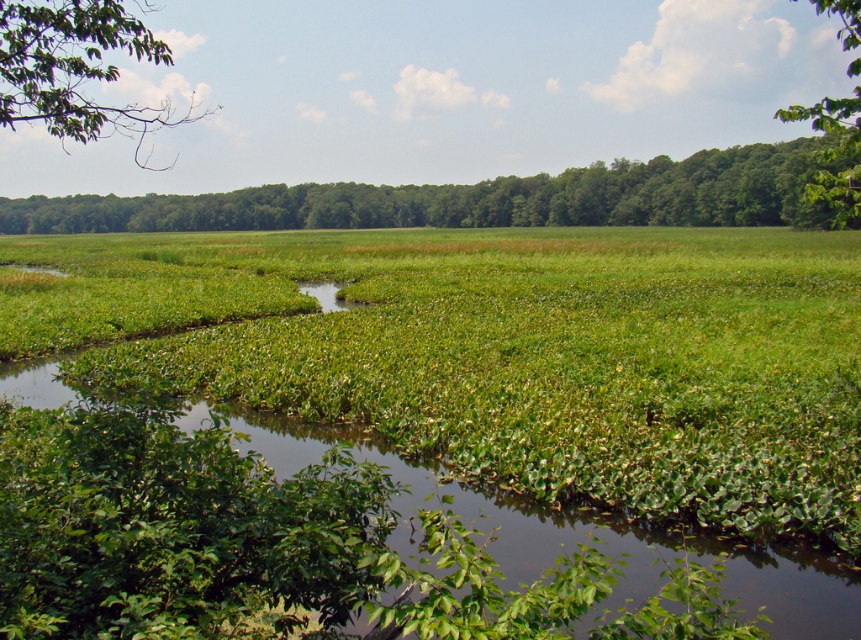
You are an ornithologist observing the landscape and want to place a bird feeder between the green leafy tree at upper center and the green leafy tree at upper right. Based on their positions, which tree is closer to the foreground, and where should you position the feeder to ensure it is visible from both trees?

The green leafy tree at upper center is closer to the foreground since the green leafy tree at upper right is behind it. Position the feeder between them, closer to the green leafy tree at upper center to ensure visibility from both trees.

You are a hiker who wants to take a photo of both the green leafy vegetation at center and the green leafy tree at upper right. You have a camera with a zoom lens that can focus up to 40 meters. Can you capture both subjects in a single photo without moving your position?

The green leafy vegetation at center is 40.40 meters away from the green leafy tree at upper right. Since the distance between them is slightly over 40 meters, the camera might struggle to capture both in a single frame without moving your position.

You are an ecologist studying the vegetation in this landscape. You observe the green leafy tree at upper center and the green leafy vegetation at center. Which of these two has a larger size?

The green leafy tree at upper center is larger in size than the green leafy vegetation at center.